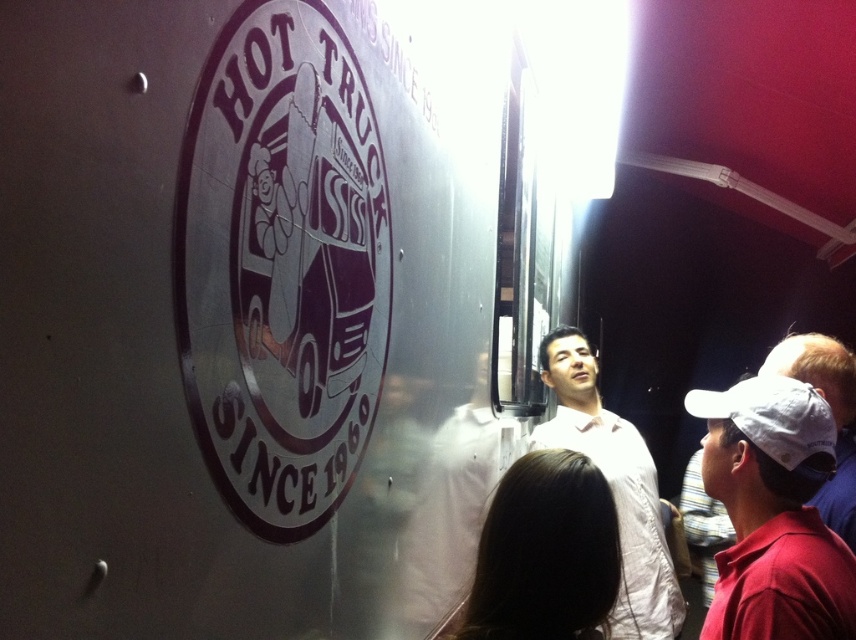
Question: Does white matte shirt at center come in front of white fabric baseball cap at right?

Choices:
 (A) yes
 (B) no

Answer: (B)

Question: Which point is closer to the camera?

Choices:
 (A) (774, 413)
 (B) (595, 611)
 (C) (538, 435)

Answer: (B)

Question: Does metallic silver food truck at center appear on the left side of white matte baseball cap at upper right?

Choices:
 (A) no
 (B) yes

Answer: (B)

Question: Estimate the real-world distances between objects in this image. Which object is farther from the white matte baseball cap at upper right?

Choices:
 (A) metallic silver food truck at center
 (B) white matte shirt at center
 (C) white fabric baseball cap at right

Answer: (A)

Question: Is brown hair at lower center further to the viewer compared to white fabric baseball cap at right?

Choices:
 (A) no
 (B) yes

Answer: (A)

Question: Considering the real-world distances, which object is farthest from the brown hair at lower center?

Choices:
 (A) white fabric baseball cap at right
 (B) metallic silver food truck at center

Answer: (B)